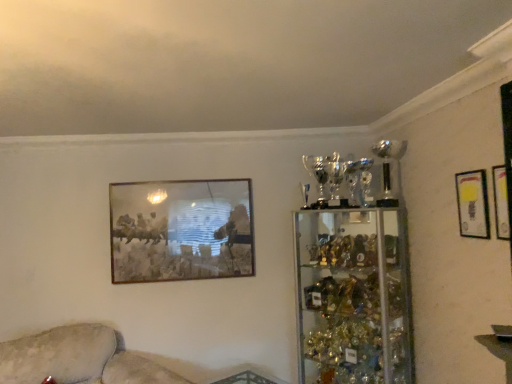
Question: Is beige fabric couch at lower left closer to camera compared to matte gold picture frame at upper right, marked as the 2th picture frame in a left-to-right arrangement?

Choices:
 (A) no
 (B) yes

Answer: (B)

Question: Does beige fabric couch at lower left turn towards matte gold picture frame at upper right, marked as the 2th picture frame in a left-to-right arrangement?

Choices:
 (A) no
 (B) yes

Answer: (A)

Question: Does beige fabric couch at lower left have a larger size compared to matte gold picture frame at upper right, which appears as the second picture frame when viewed from the back?

Choices:
 (A) yes
 (B) no

Answer: (A)

Question: Does beige fabric couch at lower left touch matte gold picture frame at upper right, the second picture frame in the front-to-back sequence?

Choices:
 (A) no
 (B) yes

Answer: (A)

Question: Does beige fabric couch at lower left have a smaller size compared to matte gold picture frame at upper right, the second picture frame viewed from the right?

Choices:
 (A) yes
 (B) no

Answer: (B)

Question: Can you confirm if beige fabric couch at lower left is shorter than matte gold picture frame at upper right, marked as the 2th picture frame in a left-to-right arrangement?

Choices:
 (A) no
 (B) yes

Answer: (A)

Question: Considering the relative sizes of beige fabric couch at lower left and metallic gold picture frame at upper center, which is the 1th picture frame in back-to-front order, in the image provided, is beige fabric couch at lower left smaller than metallic gold picture frame at upper center, which is the 1th picture frame in back-to-front order,?

Choices:
 (A) yes
 (B) no

Answer: (B)

Question: Considering the relative sizes of beige fabric couch at lower left and metallic gold picture frame at upper center, the third picture frame in the front-to-back sequence, in the image provided, is beige fabric couch at lower left shorter than metallic gold picture frame at upper center, the third picture frame in the front-to-back sequence,?

Choices:
 (A) yes
 (B) no

Answer: (A)

Question: Is beige fabric couch at lower left oriented towards metallic gold picture frame at upper center, the third picture frame in the front-to-back sequence?

Choices:
 (A) no
 (B) yes

Answer: (A)

Question: Can we say beige fabric couch at lower left lies outside metallic gold picture frame at upper center, which is the 1th picture frame in back-to-front order?

Choices:
 (A) yes
 (B) no

Answer: (A)

Question: Can you confirm if beige fabric couch at lower left is taller than metallic gold picture frame at upper center, the third picture frame in the front-to-back sequence?

Choices:
 (A) yes
 (B) no

Answer: (B)

Question: From the image's perspective, is beige fabric couch at lower left over metallic gold picture frame at upper center, placed as the first picture frame when sorted from left to right?

Choices:
 (A) yes
 (B) no

Answer: (B)

Question: From the image's perspective, is matte gold picture frame at upper right, the second picture frame viewed from the right, on metallic gold picture frame at upper center, the 3th picture frame from the right?

Choices:
 (A) no
 (B) yes

Answer: (B)